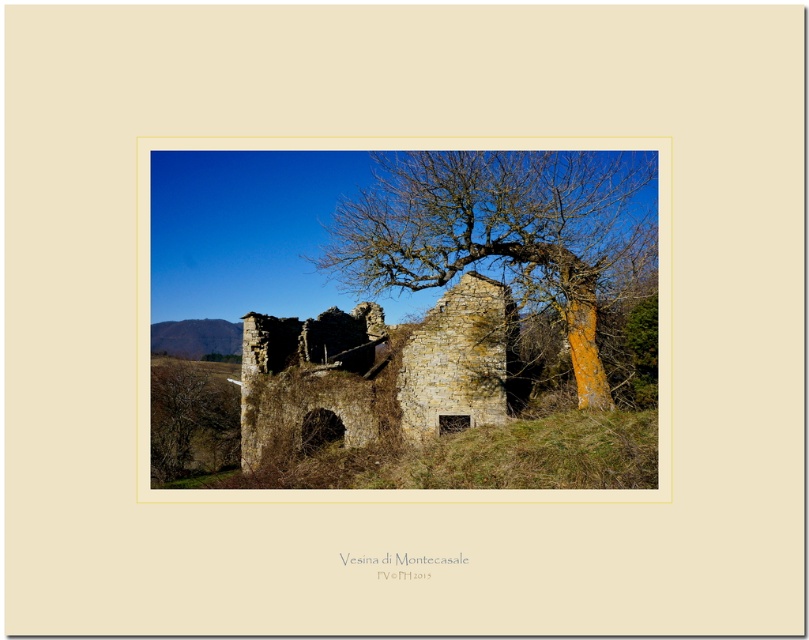
Measure the distance between yellowish-green mossy stone at center and camera.

yellowish-green mossy stone at center and camera are 39.58 meters apart.

Can you confirm if yellowish-green mossy stone at center is positioned below stone ruins at center?

No, yellowish-green mossy stone at center is not below stone ruins at center.

Identify the location of yellowish-green mossy stone at center. (510, 236).

The width and height of the screenshot is (809, 640). What do you see at coordinates (375, 372) in the screenshot? I see `stone ruins at center` at bounding box center [375, 372].

Who is more distant from viewer, [246,380] or [217,420]?

Positioned behind is point [217,420].

Is point (286, 451) farther from viewer compared to point (159, 481)?

No, it is in front of (159, 481).

In order to click on stone ruins at center in this screenshot , I will do `click(375, 372)`.

Does yellowish-green mossy stone at center appear on the right side of brown rough bark tree at lower left?

Yes, yellowish-green mossy stone at center is to the right of brown rough bark tree at lower left.

Is point (367, 202) less distant than point (217, 408)?

Yes, point (367, 202) is closer to viewer.

Find the location of `yellowish-green mossy stone at center`. yellowish-green mossy stone at center is located at coordinates (510, 236).